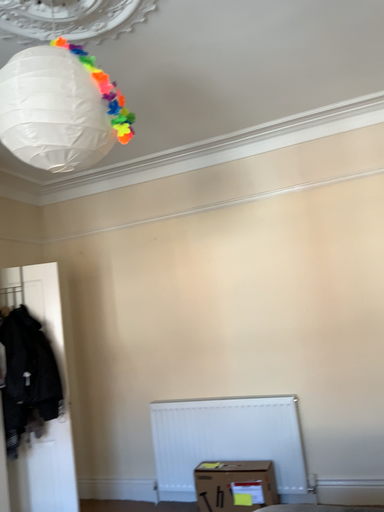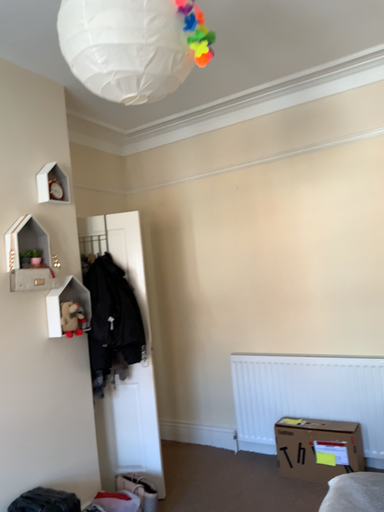
Question: Which way did the camera rotate in the video?

Choices:
 (A) rotated right
 (B) rotated left

Answer: (B)